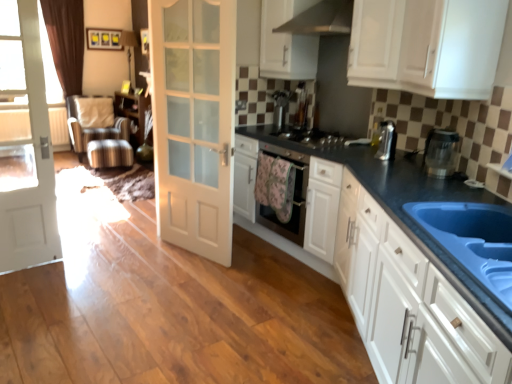
The height and width of the screenshot is (384, 512). Describe the element at coordinates (473, 239) in the screenshot. I see `blue composite sink at lower right` at that location.

What do you see at coordinates (387, 141) in the screenshot? This screenshot has height=384, width=512. I see `satin silver coffee machine at upper right, arranged as the 2th coffee machine when viewed from the back` at bounding box center [387, 141].

This screenshot has height=384, width=512. What do you see at coordinates (321, 19) in the screenshot?
I see `stainless steel exhaust hood at upper center` at bounding box center [321, 19].

I want to click on satin silver coffee machine at center, placed as the 1th coffee machine when sorted from left to right, so click(x=280, y=108).

Locate an element on the screen. Image resolution: width=512 pixels, height=384 pixels. white glossy cabinets at center, the first cabinetry from the bottom is located at coordinates (395, 268).

Does white matte door at center, which is the 1th door in right-to-left order, lie in front of satin silver coffee machine at center, the 2th coffee machine in the front-to-back sequence?

Yes, it is in front of satin silver coffee machine at center, the 2th coffee machine in the front-to-back sequence.

Is white matte door at center, which is the second door in left-to-right order, positioned with its back to satin silver coffee machine at center, placed as the second coffee machine when sorted from bottom to top?

Correct, white matte door at center, which is the second door in left-to-right order, is looking away from satin silver coffee machine at center, placed as the second coffee machine when sorted from bottom to top.

From the picture: From the image's perspective, which one is positioned lower, white matte door at center, which is the second door in left-to-right order, or satin silver coffee machine at center, the 2th coffee machine in the front-to-back sequence?

white matte door at center, which is the second door in left-to-right order.

Is point (473, 15) positioned after point (323, 32)?

No.

From a real-world perspective, relative to stainless steel exhaust hood at upper center, is white glossy cabinet at upper right, the 3th cabinetry viewed from the top, vertically above or below?

Clearly, from a real-world perspective, white glossy cabinet at upper right, the 3th cabinetry viewed from the top, is below stainless steel exhaust hood at upper center.

Is white glossy cabinet at upper right, the 3th cabinetry viewed from the top, turned away from stainless steel exhaust hood at upper center?

No, white glossy cabinet at upper right, the 3th cabinetry viewed from the top, is not facing the opposite direction of stainless steel exhaust hood at upper center.

Does white glossy cabinet at upper right, the 3th cabinetry viewed from the top, lie in front of stainless steel exhaust hood at upper center?

Yes, it is.

From a real-world perspective, is satin black stove at center physically below satin silver coffee machine at center, placed as the 1th coffee machine when sorted from left to right?

Yes.

Which object is wider, satin black stove at center or satin silver coffee machine at center, placed as the second coffee machine when sorted from bottom to top?

satin black stove at center.

From the image's perspective, between satin black stove at center and satin silver coffee machine at center, the 1th coffee machine from the top, which one is located above?

satin silver coffee machine at center, the 1th coffee machine from the top.

Is satin black stove at center oriented towards satin silver coffee machine at center, placed as the second coffee machine when sorted from bottom to top?

No, satin black stove at center is not oriented towards satin silver coffee machine at center, placed as the second coffee machine when sorted from bottom to top.

Is satin silver coffee machine at upper right, which is the 1th coffee machine in bottom-to-top order, to the right of blue composite sink at lower right from the viewer's perspective?

No, satin silver coffee machine at upper right, which is the 1th coffee machine in bottom-to-top order, is not to the right of blue composite sink at lower right.

What's the angular difference between satin silver coffee machine at upper right, which appears as the first coffee machine when viewed from the front, and blue composite sink at lower right's facing directions?

8.94 degrees.

Which is closer to the camera, (394, 153) or (471, 268)?

The point (471, 268) is in front.

Between satin silver coffee machine at upper right, the 2th coffee machine positioned from the left, and blue composite sink at lower right, which one has more height?

satin silver coffee machine at upper right, the 2th coffee machine positioned from the left, is taller.

From the image's perspective, is black glossy dishwasher at center above satin black stove at center?

No, from the image's perspective, black glossy dishwasher at center is not above satin black stove at center.

From the picture: How different are the orientations of black glossy dishwasher at center and satin black stove at center in degrees?

black glossy dishwasher at center and satin black stove at center are facing 1.23 degrees away from each other.

From a real-world perspective, is black glossy dishwasher at center physically above satin black stove at center?

No, from a real-world perspective, black glossy dishwasher at center is not over satin black stove at center

Does black glossy dishwasher at center have a lesser height compared to satin black stove at center?

No, black glossy dishwasher at center is not shorter than satin black stove at center.

Considering the sizes of objects blue composite sink at lower right and transparent plastic kettle at right in the image provided, who is taller, blue composite sink at lower right or transparent plastic kettle at right?

With more height is transparent plastic kettle at right.

Which object is further away from the camera taking this photo, blue composite sink at lower right or transparent plastic kettle at right?

transparent plastic kettle at right is more distant.

Can transparent plastic kettle at right be found inside blue composite sink at lower right?

Actually, transparent plastic kettle at right is outside blue composite sink at lower right.

From the image's perspective, is blue composite sink at lower right on top of transparent plastic kettle at right?

Actually, blue composite sink at lower right appears below transparent plastic kettle at right in the image.

Could you tell me if black glossy dishwasher at center is turned towards white glossy cabinet at upper right, which ranks as the third cabinetry in bottom-to-top order?

No, black glossy dishwasher at center is not aimed at white glossy cabinet at upper right, which ranks as the third cabinetry in bottom-to-top order.

There is a black glossy dishwasher at center. Where is `the 1st cabinetry above it (from a real-world perspective)`? This screenshot has width=512, height=384. the 1st cabinetry above it (from a real-world perspective) is located at coordinates (375, 43).

From the picture: Does black glossy dishwasher at center contain white glossy cabinet at upper right, which ranks as the third cabinetry in bottom-to-top order?

That's incorrect, white glossy cabinet at upper right, which ranks as the third cabinetry in bottom-to-top order, is not inside black glossy dishwasher at center.

Where is `the 1st door below the satin silver coffee machine at center, placed as the 1th coffee machine when sorted from left to right (from the image's perspective)`? the 1st door below the satin silver coffee machine at center, placed as the 1th coffee machine when sorted from left to right (from the image's perspective) is located at coordinates (194, 122).

The width and height of the screenshot is (512, 384). Find the location of `cabinetry that is the 2nd object directly below the stainless steel exhaust hood at upper center (from a real-world perspective)`. cabinetry that is the 2nd object directly below the stainless steel exhaust hood at upper center (from a real-world perspective) is located at coordinates (426, 46).

Looking at the image, which one is located further to satin silver coffee machine at center, the 2th coffee machine in the front-to-back sequence, white glossy cabinet at upper right, the second cabinetry positioned from the top, or black glossy dishwasher at center?

white glossy cabinet at upper right, the second cabinetry positioned from the top, is further to satin silver coffee machine at center, the 2th coffee machine in the front-to-back sequence.

Estimate the real-world distances between objects in this image. Which object is closer to white glossy cabinets at center, marked as the 4th cabinetry in a top-to-bottom arrangement, white matte door at center, which is the second door in left-to-right order, or satin silver coffee machine at upper right, the 2th coffee machine from the top?

satin silver coffee machine at upper right, the 2th coffee machine from the top.

From the image, which object appears to be farther from satin silver ottoman at left, white glossy cabinet at upper right, the 3th cabinetry viewed from the top, or stainless steel exhaust hood at upper center?

white glossy cabinet at upper right, the 3th cabinetry viewed from the top, is positioned further to the anchor satin silver ottoman at left.

Which object lies further to the anchor point satin silver ottoman at left, white glossy cabinet at upper center, marked as the first cabinetry in a top-to-bottom arrangement, or black glossy dishwasher at center?

black glossy dishwasher at center lies further to satin silver ottoman at left than the other object.

When comparing their distances from white glossy cabinets at center, marked as the 4th cabinetry in a top-to-bottom arrangement, does blue composite sink at lower right or white matte door at center, which is the second door in left-to-right order, seem closer?

A: blue composite sink at lower right is positioned closer to the anchor white glossy cabinets at center, marked as the 4th cabinetry in a top-to-bottom arrangement.

Considering their positions, is satin silver coffee machine at center, placed as the second coffee machine when sorted from bottom to top, positioned further to satin silver coffee machine at upper right, which is the 1th coffee machine in bottom-to-top order, than satin silver ottoman at left?

satin silver ottoman at left.

Based on their spatial positions, is satin silver coffee machine at center, the 1th coffee machine from the top, or transparent plastic kettle at right further from black glossy dishwasher at center?

transparent plastic kettle at right lies further to black glossy dishwasher at center than the other object.

Based on the photo, estimate the real-world distances between objects in this image. Which object is closer to white glossy cabinet at upper right, the second cabinetry positioned from the top, black glossy dishwasher at center or blue composite sink at lower right?

black glossy dishwasher at center is positioned closer to the anchor white glossy cabinet at upper right, the second cabinetry positioned from the top.

Identify the location of cabinetry between white glossy cabinet at upper right, which ranks as the third cabinetry in bottom-to-top order, and transparent plastic kettle at right vertically. (426, 46).

I want to click on dish washer positioned between white glossy cabinet at upper right, positioned as the second cabinetry in bottom-to-top order, and white glossy cabinet at upper center, marked as the first cabinetry in a top-to-bottom arrangement, from near to far, so click(x=294, y=196).

This screenshot has width=512, height=384. I want to click on kitchen appliance between blue composite sink at lower right and white glossy cabinet at upper right, which ranks as the third cabinetry in bottom-to-top order, from front to back, so (x=441, y=152).

The width and height of the screenshot is (512, 384). Identify the location of exhaust hood between satin silver coffee machine at upper right, the 2th coffee machine positioned from the left, and satin silver ottoman at left from front to back. (321, 19).